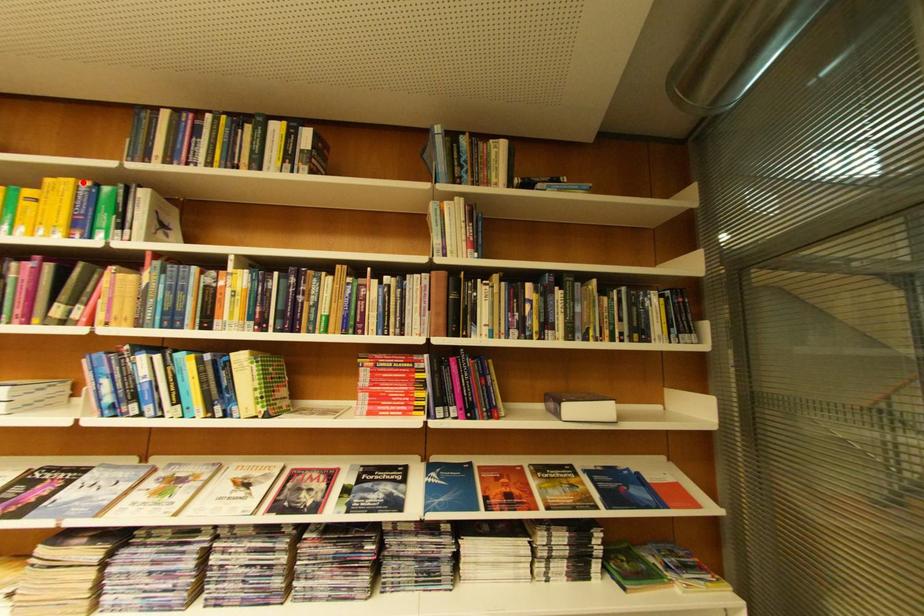
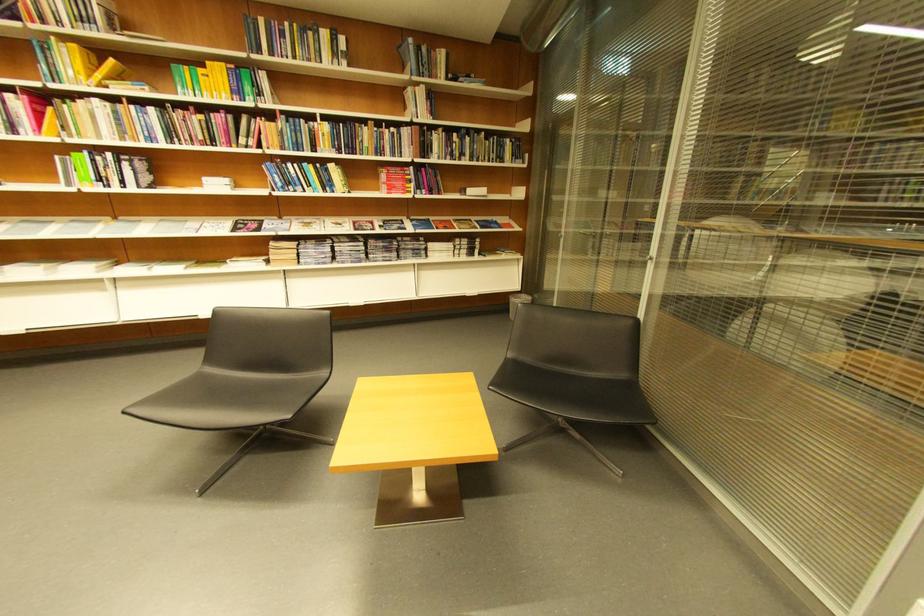
Locate, in the second image, the point that corresponds to the highlighted location in the first image.

(234, 66)